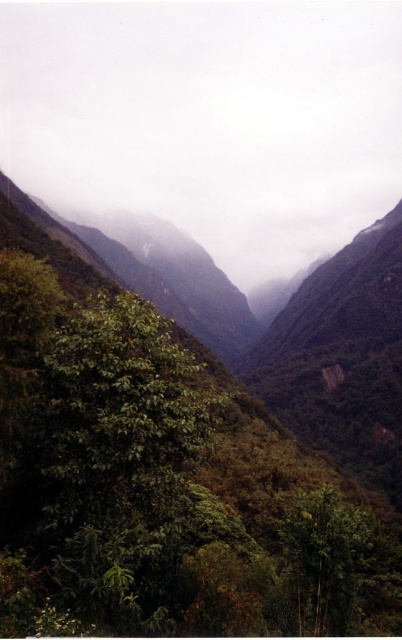
Question: Which is farther from the green matte cloud at center?

Choices:
 (A) green leafy tree at center
 (B) green matte tree at lower right

Answer: (B)

Question: Observing the image, what is the correct spatial positioning of green leafy tree at center in reference to green matte tree at lower right?

Choices:
 (A) right
 (B) left

Answer: (B)

Question: Is green matte cloud at center thinner than green leafy tree at center?

Choices:
 (A) no
 (B) yes

Answer: (A)

Question: Which of the following is the farthest from the observer?

Choices:
 (A) (338, 12)
 (B) (317, 564)

Answer: (A)

Question: Is green leafy tree at center smaller than green matte tree at lower right?

Choices:
 (A) yes
 (B) no

Answer: (B)

Question: Which is nearer to the green matte tree at lower right?

Choices:
 (A) green leafy tree at center
 (B) green matte cloud at center

Answer: (A)